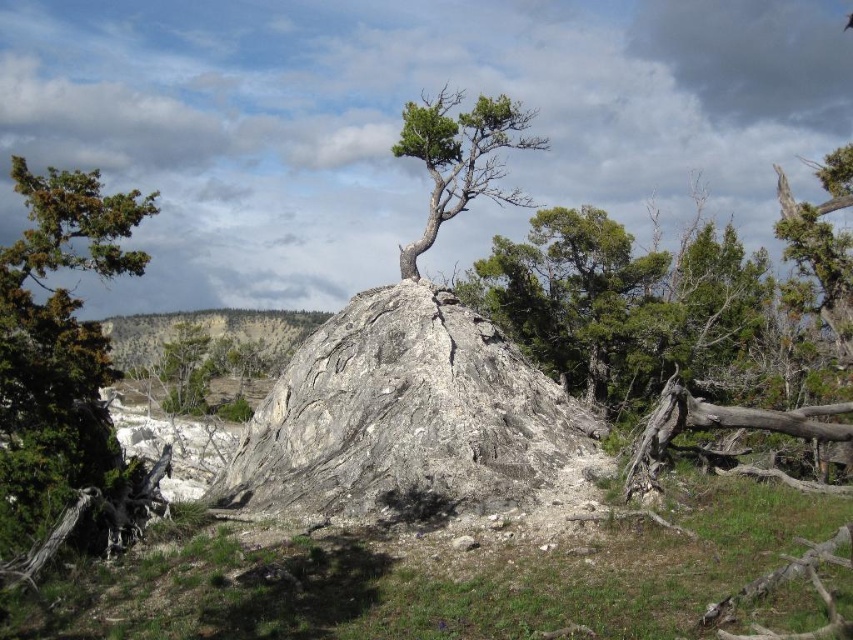
Question: Which point is closer to the camera?

Choices:
 (A) green textured tree at center
 (B) gray rough rock at center
 (C) green rough bark tree at left

Answer: (C)

Question: Is gray rough rock at center thinner than green textured tree at center?

Choices:
 (A) yes
 (B) no

Answer: (A)

Question: Estimate the real-world distances between objects in this image. Which object is closer to the green textured tree at center?

Choices:
 (A) green rough bark tree at left
 (B) gray rough rock at center

Answer: (A)

Question: Can you confirm if green rough bark tree at left is thinner than green textured tree at center?

Choices:
 (A) no
 (B) yes

Answer: (B)

Question: Estimate the real-world distances between objects in this image. Which object is closer to the green rough bark tree at left?

Choices:
 (A) gray rough rock at center
 (B) green textured tree at center

Answer: (A)

Question: Does green rough bark tree at left appear on the left side of green textured tree at center?

Choices:
 (A) yes
 (B) no

Answer: (A)